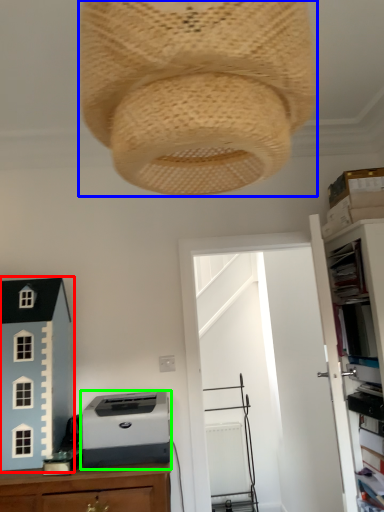
Question: Based on their relative distances, which object is farther from toy (highlighted by a red box)? Choose from lamp (highlighted by a blue box) and printer (highlighted by a green box).

Choices:
 (A) lamp
 (B) printer

Answer: (A)